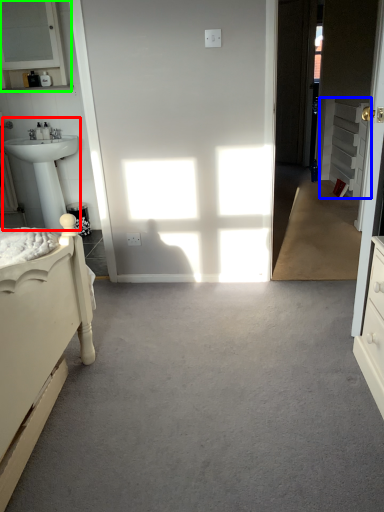
Question: Based on their relative distances, which object is nearer to sink (highlighted by a red box)? Choose from cabinetry (highlighted by a blue box) and medicine cabinet (highlighted by a green box).

Choices:
 (A) cabinetry
 (B) medicine cabinet

Answer: (B)